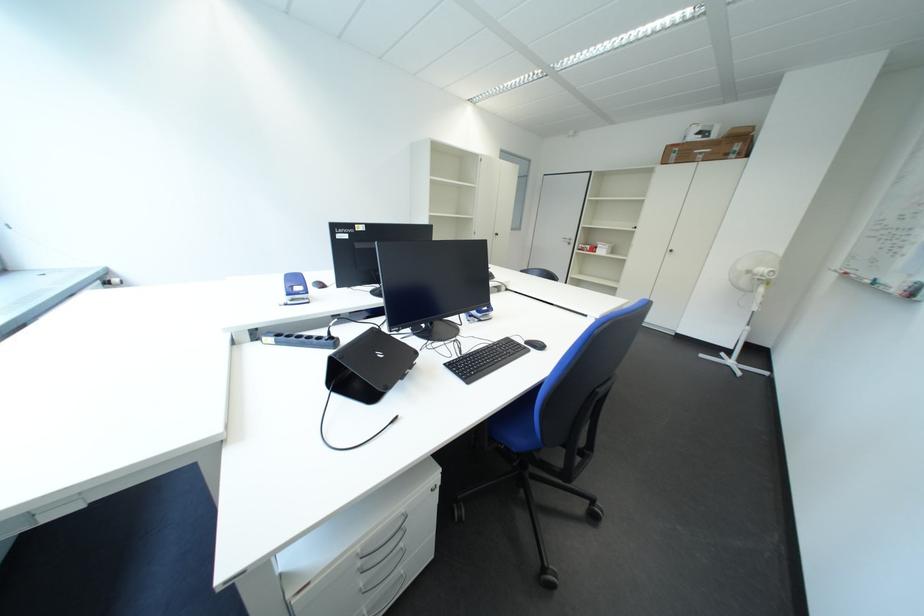
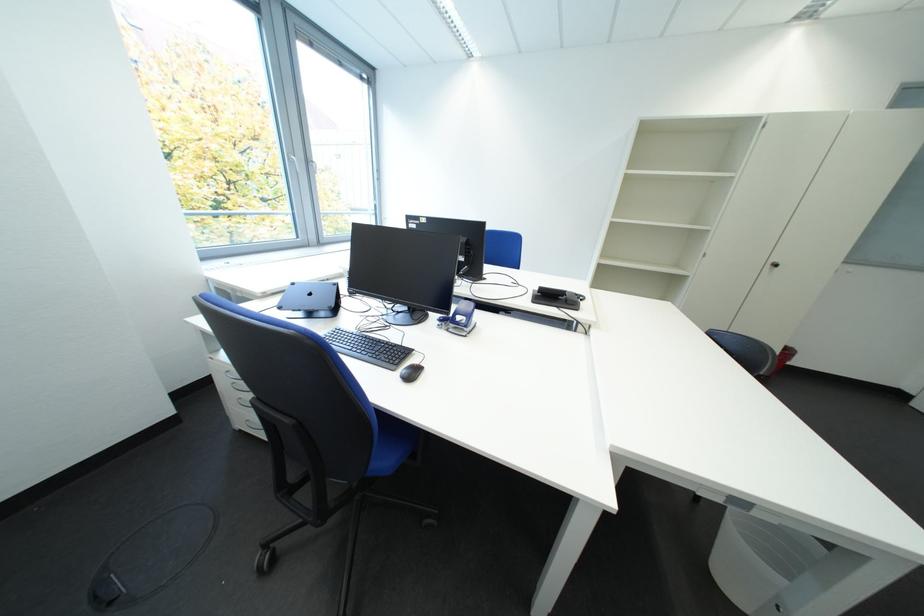
In the second image, find the point that corresponds to (531,347) in the first image.

(412, 361)